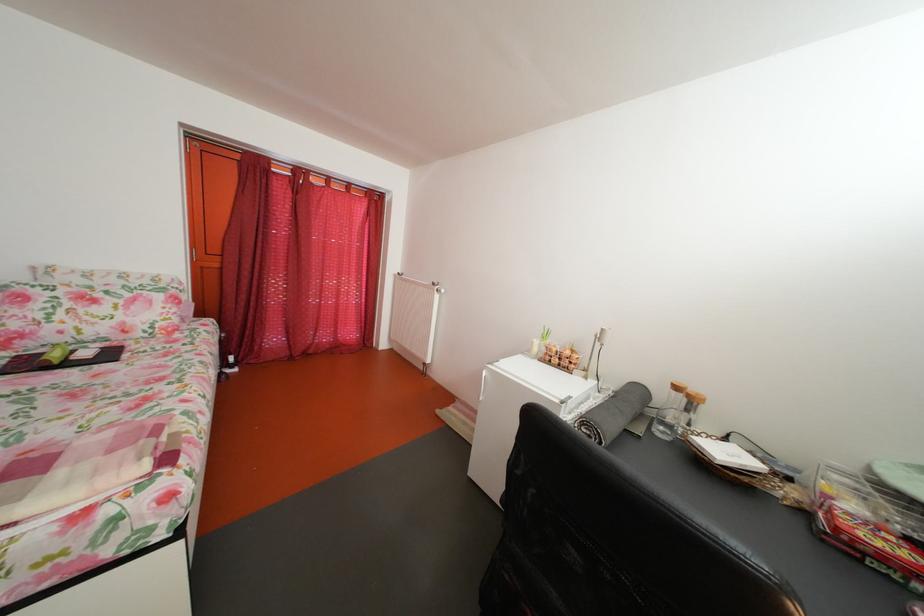
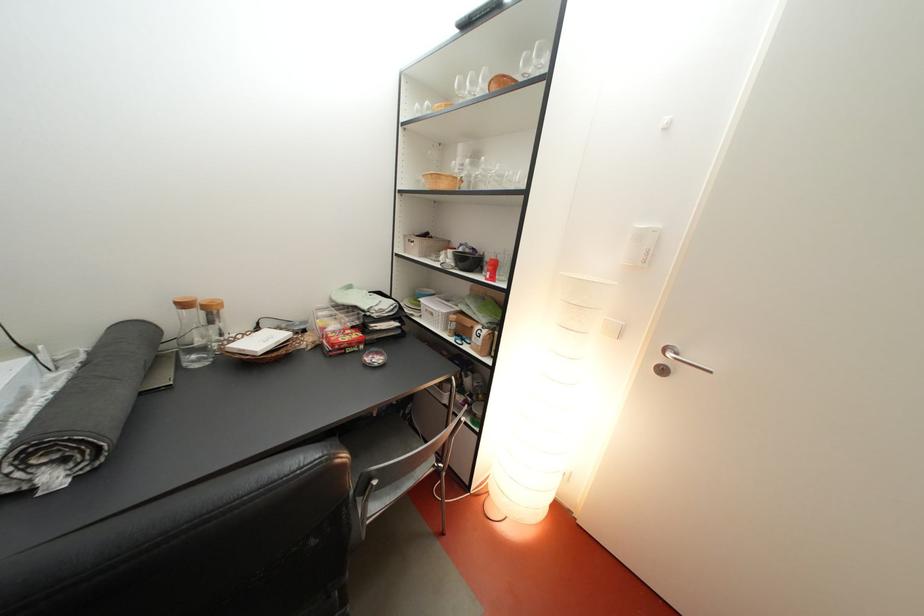
Based on the continuous images, in which direction is the camera rotating?

The camera rotated toward right-down.